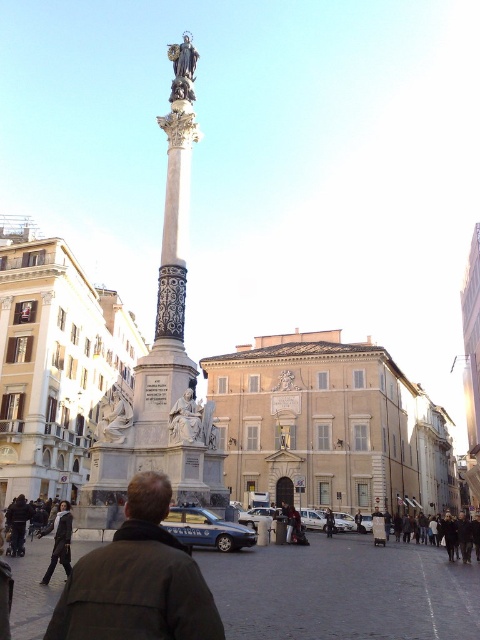
Question: Is the position of dark brown leather jacket at center less distant than that of white marble statue at center?

Choices:
 (A) yes
 (B) no

Answer: (A)

Question: Which point is closer to the camera taking this photo?

Choices:
 (A) (169, 195)
 (B) (332, 515)

Answer: (A)

Question: Among these objects, which one is nearest to the camera?

Choices:
 (A) polished bronze statue at upper center
 (B) white marble statue at lower left
 (C) dark brown leather jacket at center

Answer: (C)

Question: Can you confirm if dark brown leather jacket at center is positioned above black leather jacket at lower center?

Choices:
 (A) yes
 (B) no

Answer: (A)

Question: Does dark gray jacket at lower left appear under black leather jacket at lower center?

Choices:
 (A) no
 (B) yes

Answer: (A)

Question: Which point is closer to the camera taking this photo?

Choices:
 (A) (37, 536)
 (B) (122, 408)
 (C) (182, 172)
 (D) (183, 42)

Answer: (B)